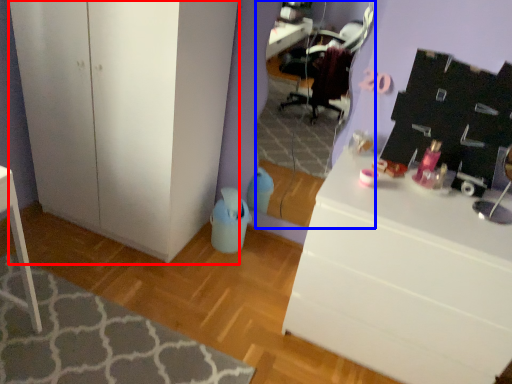
Question: Which point is further to the camera, cabinetry (highlighted by a red box) or mirror (highlighted by a blue box)?

Choices:
 (A) cabinetry
 (B) mirror

Answer: (B)